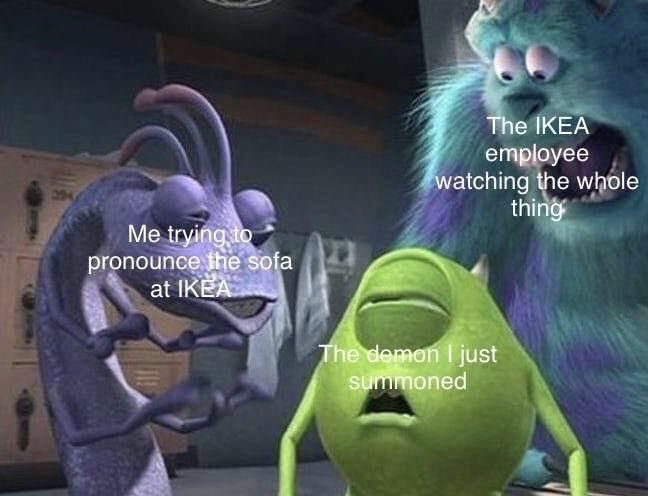
Identify the location of floor. The height and width of the screenshot is (496, 648). (233, 481).